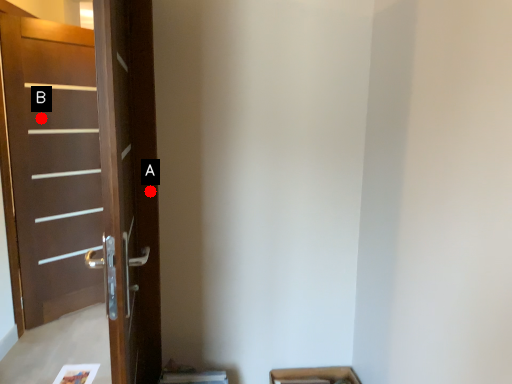
Question: Two points are circled on the image, labeled by A and B beside each circle. Which point appears farthest from the camera in this image?

Choices:
 (A) A is further
 (B) B is further

Answer: (B)